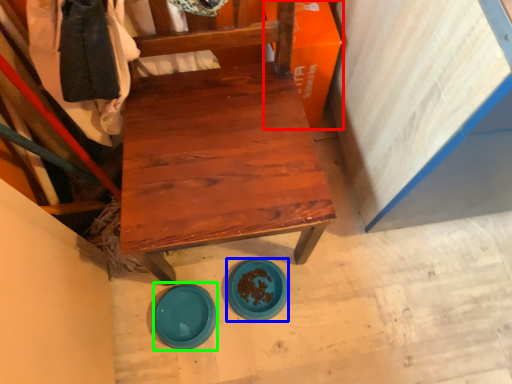
Question: Considering the real-world distances, which object is closest to cardboard box (highlighted by a red box)? plate (highlighted by a blue box) or plate (highlighted by a green box).

Choices:
 (A) plate
 (B) plate

Answer: (A)